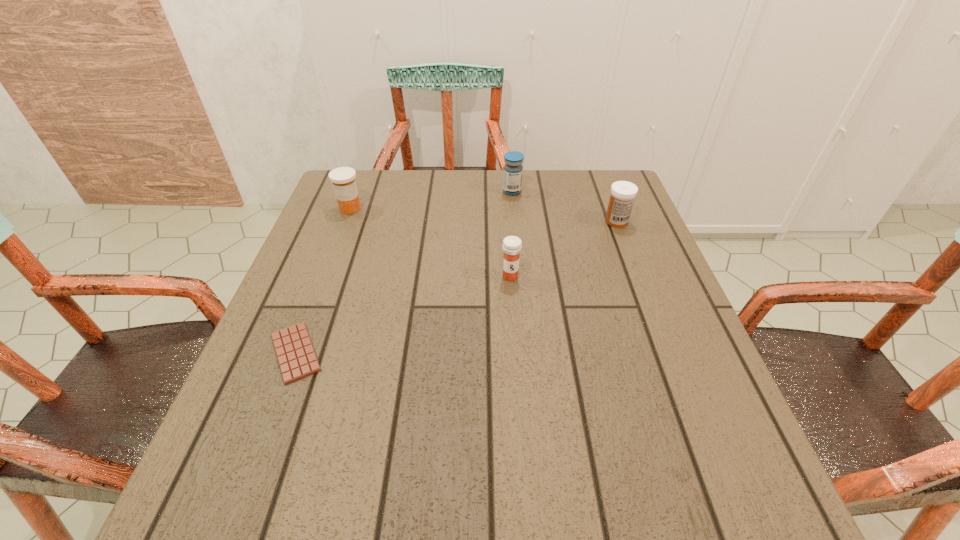
Where is `vacant space located on the right of the nearest object`? vacant space located on the right of the nearest object is located at coordinates (494, 353).

Where is `medicine at the left edge`? This screenshot has width=960, height=540. medicine at the left edge is located at coordinates pos(343,178).

This screenshot has width=960, height=540. Identify the location of candy bar present at the left edge. (297, 359).

The width and height of the screenshot is (960, 540). What are the coordinates of `object that is at the right edge` in the screenshot? It's located at (623, 193).

The width and height of the screenshot is (960, 540). I want to click on object that is at the far left corner, so click(x=343, y=178).

Find the location of `object positioned at the far right corner`. object positioned at the far right corner is located at coordinates (623, 193).

Where is `vacant area at the far edge`? This screenshot has width=960, height=540. vacant area at the far edge is located at coordinates (403, 184).

The width and height of the screenshot is (960, 540). I want to click on free region at the near edge of the desktop, so (x=604, y=464).

In the image, there is a desktop. At what (x,y) coordinates should I click in order to perform the action: click on vacant space at the left edge. Please return your answer as a coordinate pair (x, y). Image resolution: width=960 pixels, height=540 pixels. Looking at the image, I should click on (357, 226).

At what (x,y) coordinates should I click in order to perform the action: click on free location at the right edge of the desktop. Please return your answer as a coordinate pair (x, y). The image size is (960, 540). Looking at the image, I should click on (667, 280).